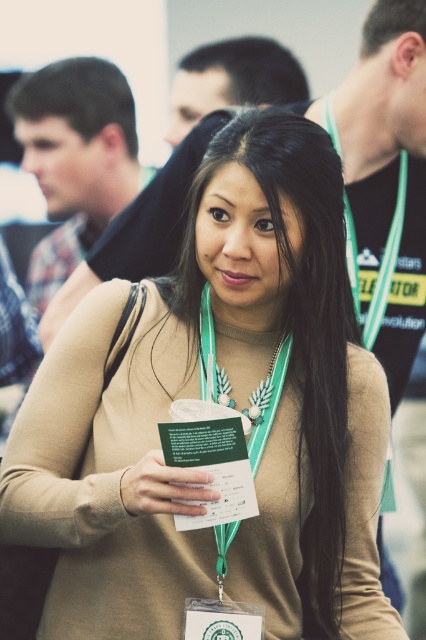
Question: Which object is farther from the camera taking this photo?

Choices:
 (A) green paper card at center
 (B) dark brown hair at upper left
 (C) teal fabric lanyard at center

Answer: (B)

Question: Which object is closer to the camera taking this photo?

Choices:
 (A) teal fabric necklace at center
 (B) green fabric lanyard at right
 (C) teal fabric lanyard at center
 (D) green paper card at center

Answer: (D)

Question: Can you confirm if green paper card at center is positioned above teal fabric necklace at center?

Choices:
 (A) yes
 (B) no

Answer: (B)

Question: Which of the following is the closest to the observer?

Choices:
 (A) (385, 278)
 (B) (229, 525)

Answer: (B)

Question: Is dark brown hair at upper left closer to the viewer compared to green fabric lanyard at right?

Choices:
 (A) yes
 (B) no

Answer: (B)

Question: Does green paper card at center have a smaller size compared to teal fabric lanyard at center?

Choices:
 (A) no
 (B) yes

Answer: (B)